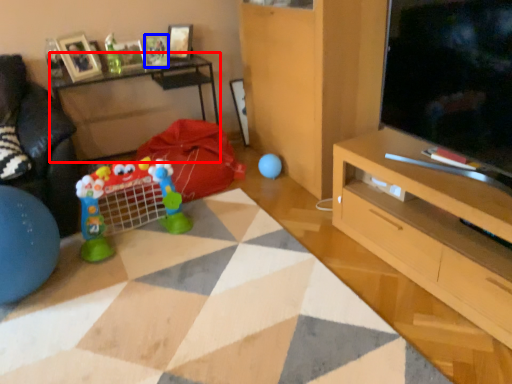
Question: Which of the following is the farthest to the observer, table (highlighted by a red box) or picture frame (highlighted by a blue box)?

Choices:
 (A) table
 (B) picture frame

Answer: (B)